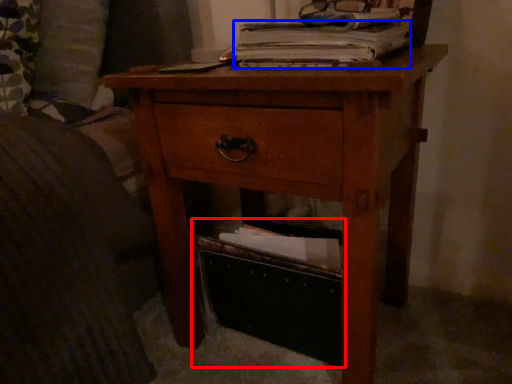
Question: Among these objects, which one is nearest to the camera, storage box (highlighted by a red box) or paperback book (highlighted by a blue box)?

Choices:
 (A) storage box
 (B) paperback book

Answer: (B)